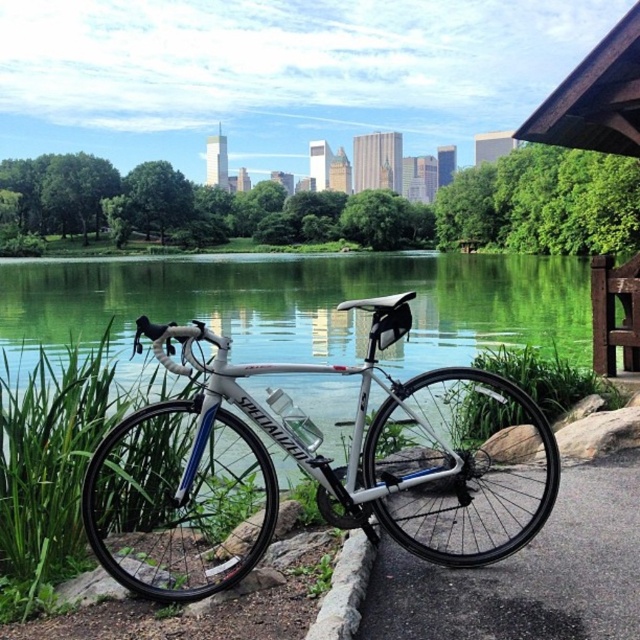
You are standing at the edge of the water and want to reach the white metallic bicycle at center without getting your shoes wet. The distance between you and the bicycle is 2.85 meters. If your longest stride is 0.8 meters, how many strides will you need to take to reach the bicycle?

The distance between you and the white metallic bicycle at center is 2.85 meters. Since each stride covers 0.8 meters, dividing 2.85 by 0.8 gives approximately 3.56 strides. Since you can only take whole strides, you would need to take 4 strides to reach the white metallic bicycle at center without getting your shoes wet.

You are standing at the point marked by the coordinates point (529,573), which is on the black asphalt pavement at lower right. You want to walk towards the white Specialized road bicycle parked near the serene body of water. Which direction should you move to reach the bicycle?

The point (529,573) is located on the black asphalt pavement at lower right. Since the bicycle is parked near the serene body of water, you should move towards the upper left direction to reach the bicycle.